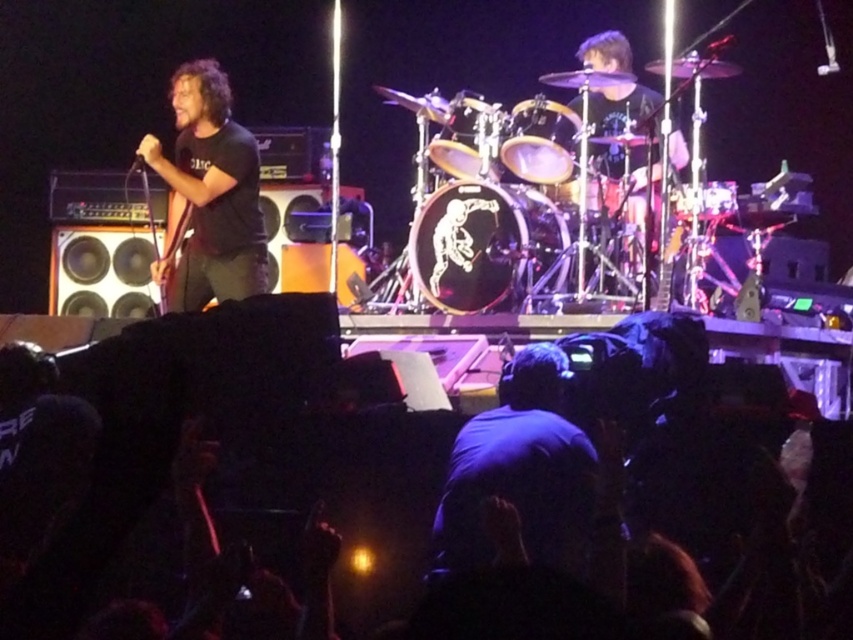
Between point (618, 173) and point (505, 157), which one is positioned in front?

Point (505, 157)

Between point (653, 124) and point (560, 120), which one is positioned in front?

Point (560, 120)

Locate an element on the screen. This screenshot has width=853, height=640. shiny black drum set at center is located at coordinates (624, 108).

Does black fabric crowd at lower center appear under black matte shirt at left?

Yes.

Does black fabric crowd at lower center have a greater height compared to black matte shirt at left?

No, black fabric crowd at lower center is not taller than black matte shirt at left.

Who is more distant from viewer, (573,595) or (231,188)?

Positioned behind is point (231,188).

This screenshot has height=640, width=853. Find the location of `black fabric crowd at lower center`. black fabric crowd at lower center is located at coordinates (137, 440).

Does shiny gold drum at center have a lesser height compared to shiny silver drum at center?

Correct, shiny gold drum at center is not as tall as shiny silver drum at center.

Which is in front, point (509, 145) or point (445, 145)?

Point (509, 145)

What do you see at coordinates (540, 140) in the screenshot? I see `shiny gold drum at center` at bounding box center [540, 140].

This screenshot has height=640, width=853. I want to click on shiny gold drum at center, so click(x=540, y=140).